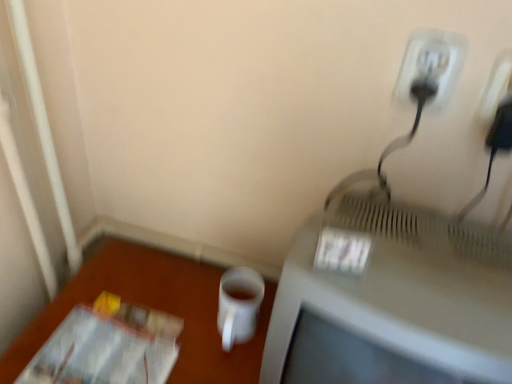
Question: Can you confirm if transparent plastic magazine at lower left is bigger than white plastic outlet at upper right?

Choices:
 (A) yes
 (B) no

Answer: (A)

Question: Is transparent plastic magazine at lower left oriented away from white plastic outlet at upper right?

Choices:
 (A) yes
 (B) no

Answer: (B)

Question: Is white plastic outlet at upper right located within transparent plastic magazine at lower left?

Choices:
 (A) yes
 (B) no

Answer: (B)

Question: Is transparent plastic magazine at lower left beside white plastic outlet at upper right?

Choices:
 (A) yes
 (B) no

Answer: (B)

Question: Does transparent plastic magazine at lower left have a greater width compared to white plastic outlet at upper right?

Choices:
 (A) no
 (B) yes

Answer: (B)

Question: Relative to black plastic plug at upper right, is white matte mug at lower center in front or behind?

Choices:
 (A) behind
 (B) front

Answer: (A)

Question: Do you think white matte mug at lower center is within black plastic plug at upper right, or outside of it?

Choices:
 (A) outside
 (B) inside

Answer: (A)

Question: Considering the positions of point (234, 291) and point (413, 46), is point (234, 291) closer or farther from the camera than point (413, 46)?

Choices:
 (A) closer
 (B) farther

Answer: (B)

Question: Is white matte mug at lower center taller or shorter than black plastic plug at upper right?

Choices:
 (A) tall
 (B) short

Answer: (B)

Question: In terms of size, does white matte cup at lower right appear bigger or smaller than black plastic plug at upper right?

Choices:
 (A) small
 (B) big

Answer: (B)

Question: Does point (105, 264) appear closer or farther from the camera than point (416, 66)?

Choices:
 (A) farther
 (B) closer

Answer: (A)

Question: From the image's perspective, is white matte cup at lower right located above or below black plastic plug at upper right?

Choices:
 (A) below
 (B) above

Answer: (A)

Question: In the image, is white matte cup at lower right positioned in front of or behind black plastic plug at upper right?

Choices:
 (A) behind
 (B) front

Answer: (B)

Question: From the image's perspective, is transparent plastic magazine at lower left above or below white matte mug at lower center?

Choices:
 (A) below
 (B) above

Answer: (A)

Question: Considering the positions of point (159, 357) and point (251, 314), is point (159, 357) closer or farther from the camera than point (251, 314)?

Choices:
 (A) closer
 (B) farther

Answer: (A)